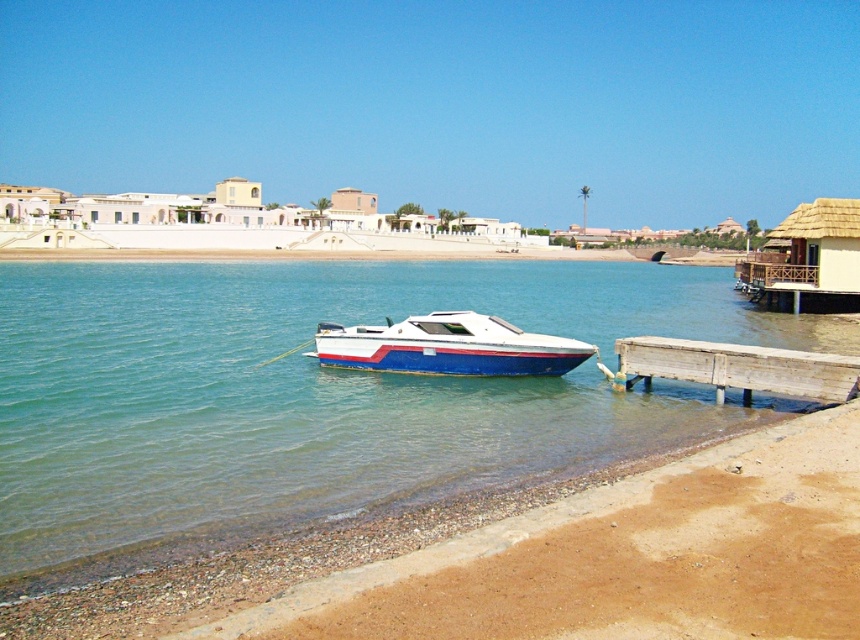
Does blue glossy water at center come in front of wooden dock at lower right?

Yes, it is.

This screenshot has height=640, width=860. What do you see at coordinates (317, 396) in the screenshot? I see `blue glossy water at center` at bounding box center [317, 396].

What are the coordinates of `blue glossy water at center` in the screenshot? It's located at (317, 396).

I want to click on blue glossy water at center, so click(x=317, y=396).

Which is in front, point (48, 364) or point (523, 368)?

Positioned in front is point (523, 368).

At what (x,y) coordinates should I click in order to perform the action: click on blue glossy water at center. Please return your answer as a coordinate pair (x, y). Looking at the image, I should click on (317, 396).

Who is higher up, white glossy boat at center or wooden dock at lower right?

white glossy boat at center is above.

How much distance is there between white glossy boat at center and wooden dock at lower right?

white glossy boat at center and wooden dock at lower right are 13.29 feet apart from each other.

Where is `white glossy boat at center`? This screenshot has width=860, height=640. white glossy boat at center is located at coordinates tap(447, 346).